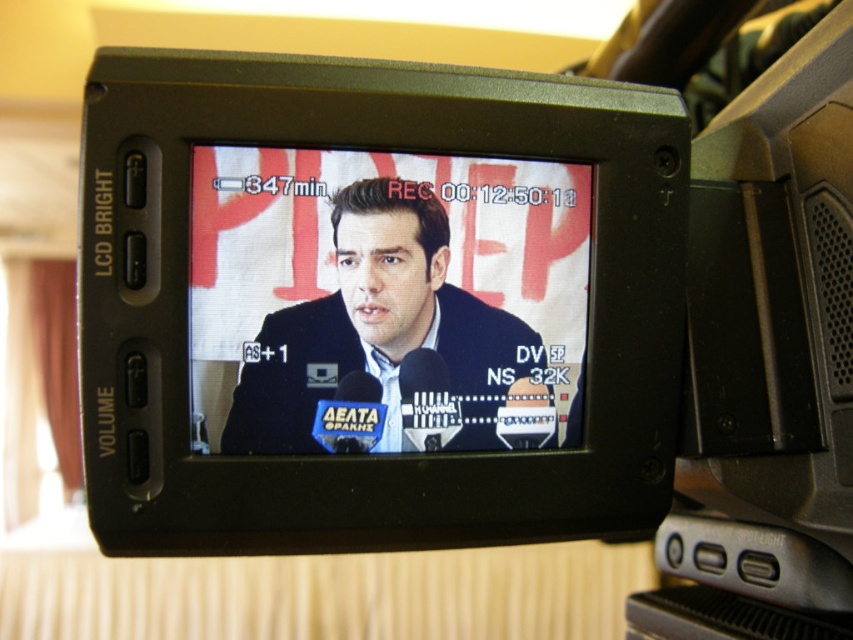
Which of these two, black plastic camera at center or matte black suit at center, stands taller?

Standing taller between the two is black plastic camera at center.

The image size is (853, 640). I want to click on black plastic camera at center, so click(x=374, y=304).